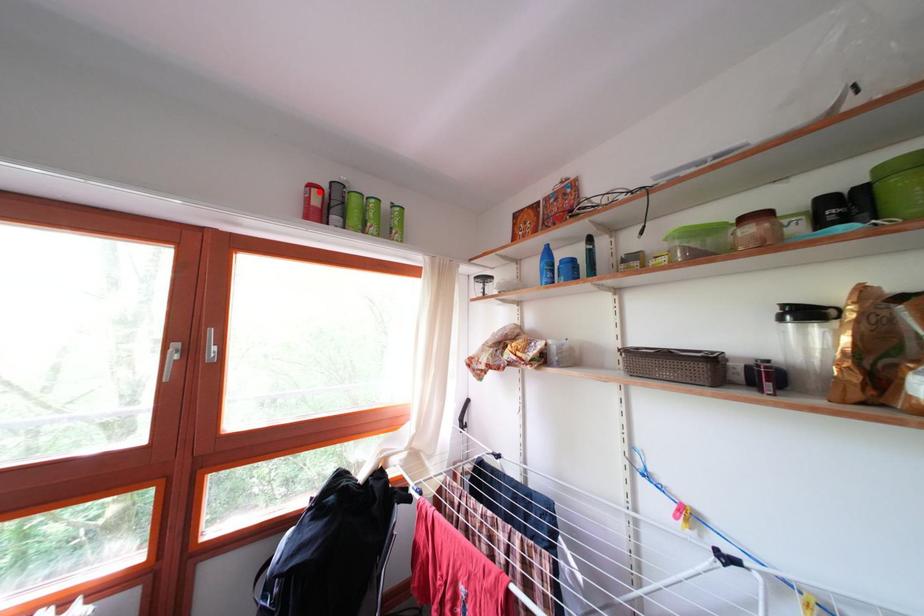
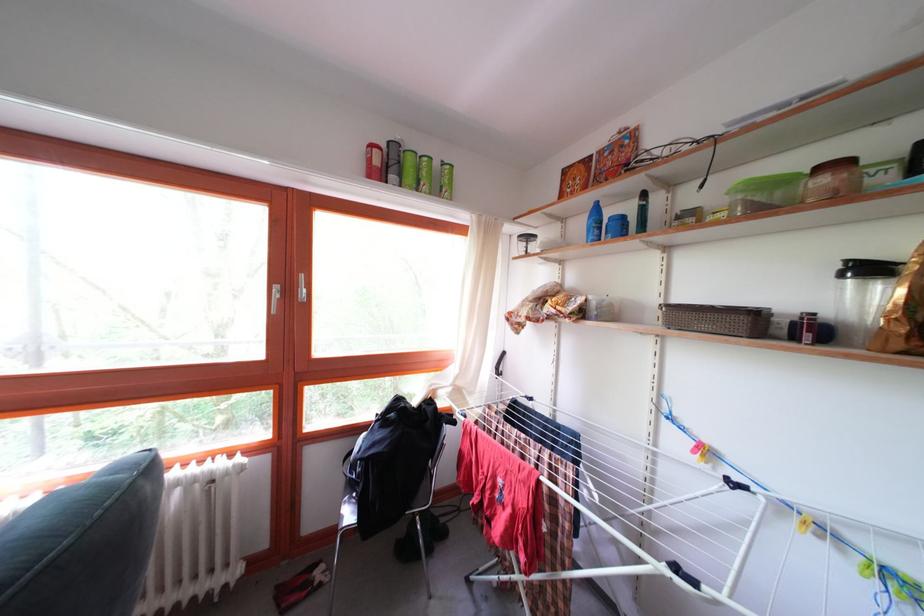
Find the pixel in the second image that matches the highlighted location in the first image.

(381, 152)